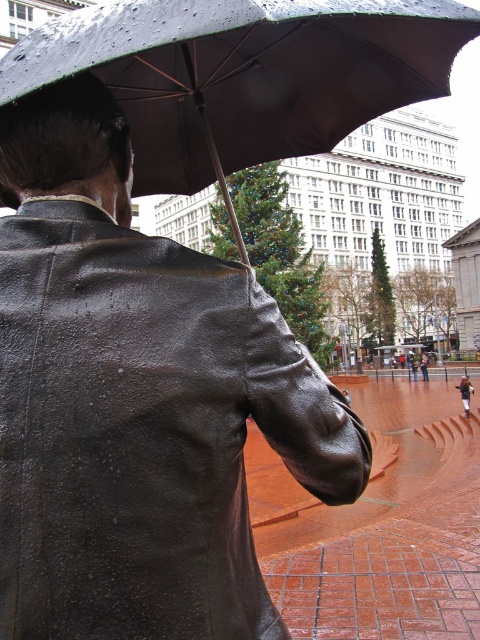
Question: Estimate the real-world distances between objects in this image. Which object is farther from the brown leather jacket at center?

Choices:
 (A) shiny black umbrella at upper center
 (B) shiny brown coat at center

Answer: (B)

Question: Observing the image, what is the correct spatial positioning of shiny brown coat at center in reference to shiny black umbrella at upper center?

Choices:
 (A) above
 (B) below

Answer: (B)

Question: Which object is positioned farthest from the shiny black umbrella at upper center?

Choices:
 (A) shiny brown coat at center
 (B) brown leather jacket at center

Answer: (B)

Question: Does shiny brown coat at center appear on the right side of brown leather jacket at center?

Choices:
 (A) yes
 (B) no

Answer: (B)

Question: In this image, where is shiny brown coat at center located relative to shiny black umbrella at upper center?

Choices:
 (A) below
 (B) above

Answer: (A)

Question: Which object appears farthest from the camera in this image?

Choices:
 (A) shiny black umbrella at upper center
 (B) brown leather jacket at center

Answer: (B)